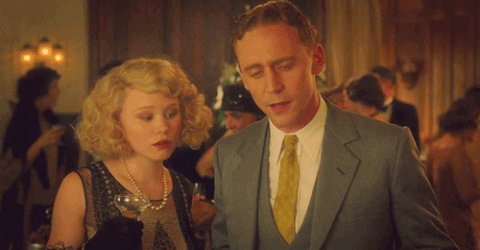
The width and height of the screenshot is (480, 250). In order to click on off-white drapes in this screenshot , I will do 349,31.